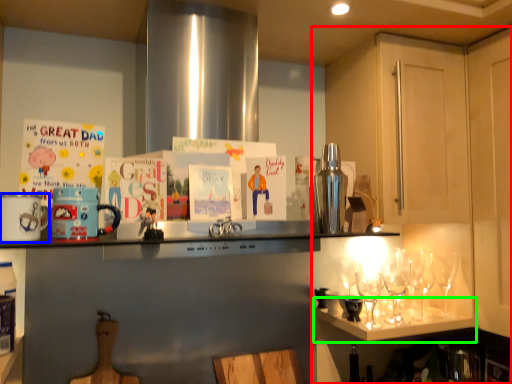
Question: Considering the real-world distances, which object is farthest from cabinetry (highlighted by a red box)? appliance (highlighted by a blue box) or shelf (highlighted by a green box)?

Choices:
 (A) appliance
 (B) shelf

Answer: (A)